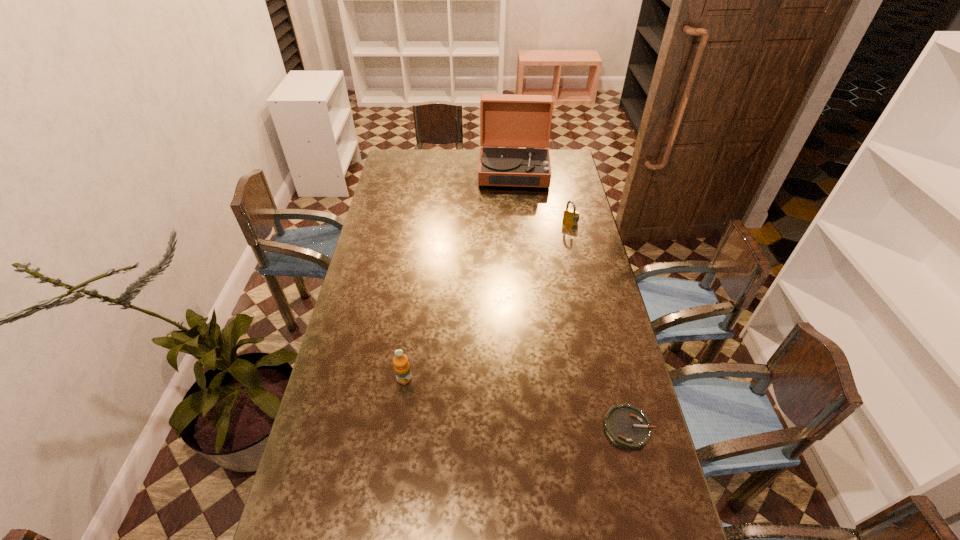
Find the location of a particular element. Image resolution: width=960 pixels, height=540 pixels. object present at the far right corner is located at coordinates (524, 121).

The height and width of the screenshot is (540, 960). What are the coordinates of `vacant space at the far edge` in the screenshot? It's located at (433, 154).

Where is `free space at the near edge of the desktop`? The height and width of the screenshot is (540, 960). free space at the near edge of the desktop is located at coordinates (591, 523).

Where is `free region at the left edge of the desktop`? The height and width of the screenshot is (540, 960). free region at the left edge of the desktop is located at coordinates (398, 180).

The height and width of the screenshot is (540, 960). I want to click on free space at the right edge, so pyautogui.click(x=574, y=190).

Locate an element on the screen. Image resolution: width=960 pixels, height=540 pixels. free location at the far left corner of the desktop is located at coordinates (412, 164).

Locate an element on the screen. The image size is (960, 540). vacant space that is in between the tallest object and the padlock is located at coordinates (542, 197).

The image size is (960, 540). I want to click on vacant space that is in between the orange juice and the shortest object, so click(516, 403).

Image resolution: width=960 pixels, height=540 pixels. I want to click on unoccupied position between the nearest object and the third object from right to left, so click(571, 300).

Locate an element on the screen. The image size is (960, 540). free spot between the third shortest object and the phonograph record is located at coordinates (459, 275).